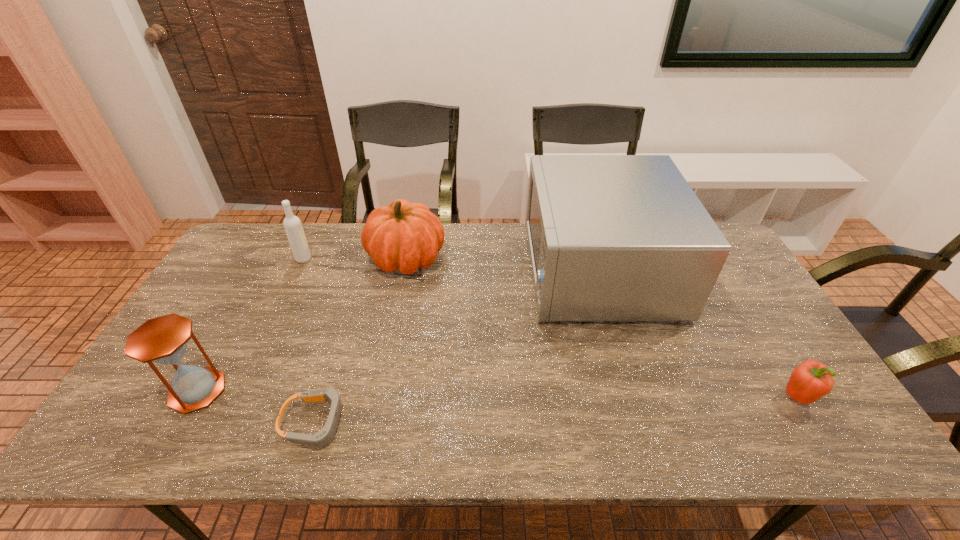
The image size is (960, 540). Identify the location of microwave oven. (611, 237).

Locate an element on the screen. The height and width of the screenshot is (540, 960). the tallest object is located at coordinates (611, 237).

At what (x,y) coordinates should I click in order to perform the action: click on pumpkin. Please return your answer as a coordinate pair (x, y). The width and height of the screenshot is (960, 540). Looking at the image, I should click on (404, 236).

Where is `vodka`? This screenshot has width=960, height=540. vodka is located at coordinates (292, 224).

Find the location of a particular element. The image size is (960, 540). hourglass is located at coordinates coord(163,340).

This screenshot has width=960, height=540. I want to click on the rightmost object, so click(811, 380).

Image resolution: width=960 pixels, height=540 pixels. Identify the location of the fifth tallest object. (811, 380).

Identify the location of goggles. The image size is (960, 540). (323, 437).

Where is `free location located with the door open on the tallest object`? This screenshot has width=960, height=540. free location located with the door open on the tallest object is located at coordinates (460, 269).

The width and height of the screenshot is (960, 540). Find the location of `free space located 0.190m with the door open on the tallest object`. free space located 0.190m with the door open on the tallest object is located at coordinates (469, 269).